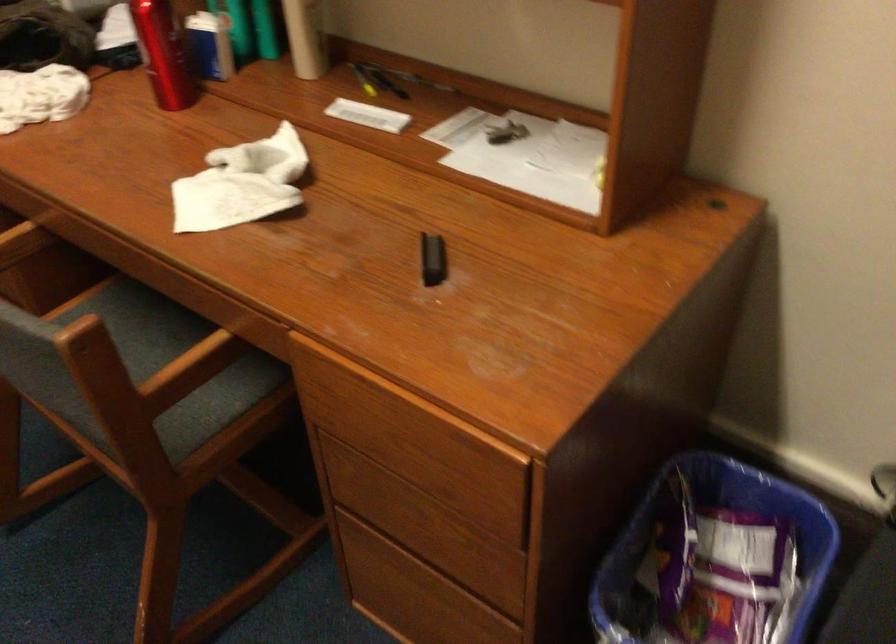
What do you see at coordinates (175, 361) in the screenshot? The image size is (896, 644). I see `the chair sitting surface` at bounding box center [175, 361].